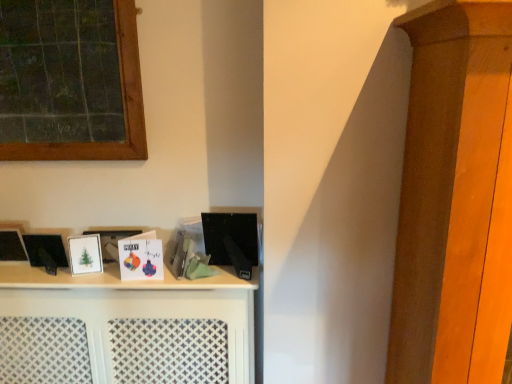
Question: Is white matte shelf at center facing away from matte black book at center, which appears as the first book when viewed from the right?

Choices:
 (A) no
 (B) yes

Answer: (A)

Question: Does white matte shelf at center appear on the left side of matte black book at center, which is the 2th book from left to right?

Choices:
 (A) no
 (B) yes

Answer: (B)

Question: Could you tell me if white matte shelf at center is turned towards matte black book at center, which is the 2th book from left to right?

Choices:
 (A) no
 (B) yes

Answer: (A)

Question: Can you confirm if white matte shelf at center is taller than matte black book at center, which appears as the first book when viewed from the right?

Choices:
 (A) yes
 (B) no

Answer: (A)

Question: From the image's perspective, is white matte shelf at center under matte black book at center, which is the 2th book from left to right?

Choices:
 (A) yes
 (B) no

Answer: (A)

Question: Does point (62, 157) appear closer or farther from the camera than point (94, 259)?

Choices:
 (A) farther
 (B) closer

Answer: (A)

Question: Considering the relative positions of green chalkboard at upper left and white matte picture frame at left in the image provided, is green chalkboard at upper left to the left or to the right of white matte picture frame at left?

Choices:
 (A) left
 (B) right

Answer: (A)

Question: In terms of height, does green chalkboard at upper left look taller or shorter compared to white matte picture frame at left?

Choices:
 (A) tall
 (B) short

Answer: (A)

Question: Looking at the image, does green chalkboard at upper left seem bigger or smaller compared to white matte picture frame at left?

Choices:
 (A) big
 (B) small

Answer: (A)

Question: Would you say matte paper card at center, the second book from the right, is to the left or to the right of matte black book at center, which appears as the first book when viewed from the right, in the picture?

Choices:
 (A) left
 (B) right

Answer: (A)

Question: From a real-world perspective, is matte paper card at center, the 1th book viewed from the left, positioned above or below matte black book at center, which appears as the first book when viewed from the right?

Choices:
 (A) below
 (B) above

Answer: (B)

Question: In terms of height, does matte paper card at center, the second book from the right, look taller or shorter compared to matte black book at center, which is the 2th book from left to right?

Choices:
 (A) tall
 (B) short

Answer: (A)

Question: Looking at their shapes, would you say matte paper card at center, the 1th book viewed from the left, is wider or thinner than matte black book at center, which appears as the first book when viewed from the right?

Choices:
 (A) thin
 (B) wide

Answer: (B)

Question: In terms of height, does matte paper card at center, the 1th book viewed from the left, look taller or shorter compared to green chalkboard at upper left?

Choices:
 (A) short
 (B) tall

Answer: (A)

Question: Based on their positions, is matte paper card at center, the second book from the right, located to the left or right of green chalkboard at upper left?

Choices:
 (A) right
 (B) left

Answer: (A)